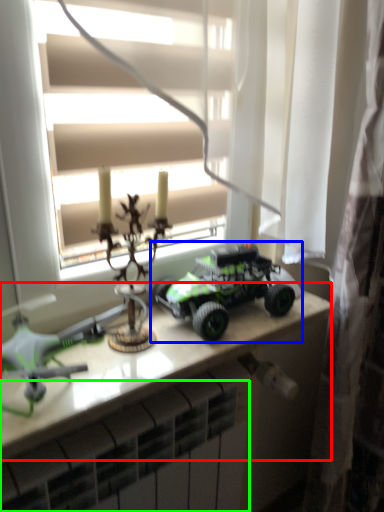
Question: Which object is the closest to the table (highlighted by a red box)? Choose among these: toy (highlighted by a blue box) or radiator (highlighted by a green box).

Choices:
 (A) toy
 (B) radiator

Answer: (A)